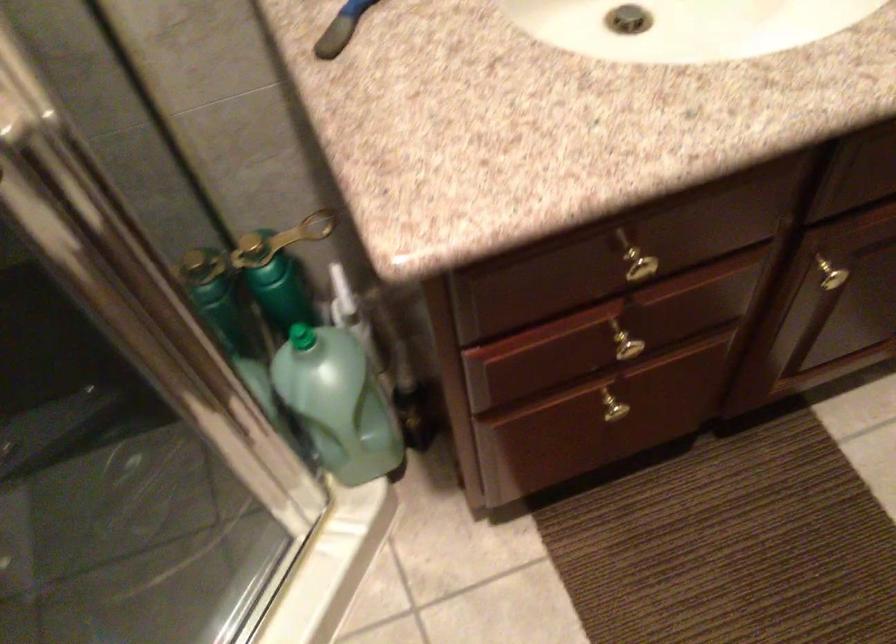
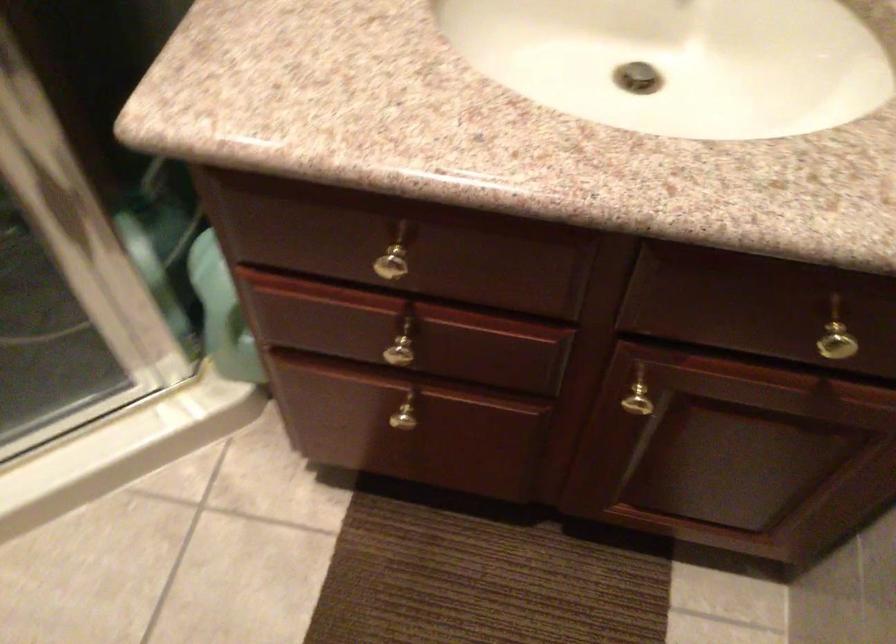
Where in the second image is the point corresponding to point (631, 348) from the first image?

(401, 354)